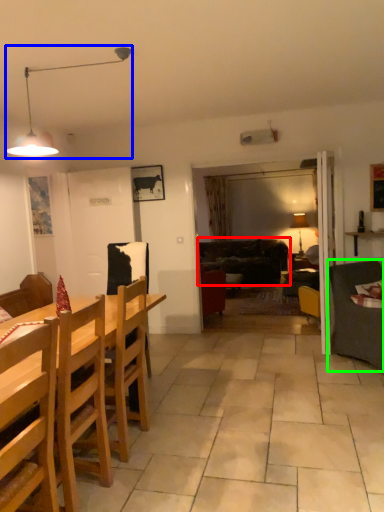
Question: Based on their relative distances, which object is nearer to studio couch (highlighted by a red box)? Choose from lamp (highlighted by a blue box) and studio couch (highlighted by a green box).

Choices:
 (A) lamp
 (B) studio couch

Answer: (B)